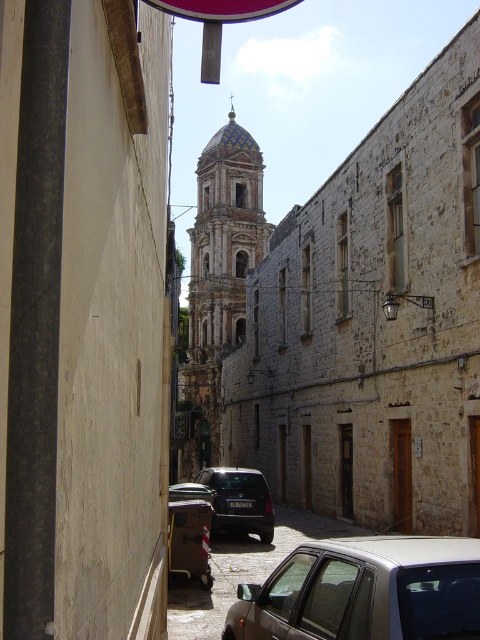
Who is lower down, stone tower at center or dark gray matte car at center?

Positioned lower is dark gray matte car at center.

Does stone tower at center come behind dark gray matte car at center?

No, it is not.

Does point (239, 364) come farther from viewer compared to point (239, 531)?

That is True.

Identify the location of stone tower at center. (374, 323).

Can you confirm if stone tower at center is bigger than golden mosaic dome at center?

No.

Can you confirm if stone tower at center is positioned to the right of golden mosaic dome at center?

Correct, you'll find stone tower at center to the right of golden mosaic dome at center.

Which is behind, point (333, 483) or point (180, 371)?

The point (180, 371) is behind.

Image resolution: width=480 pixels, height=640 pixels. In order to click on stone tower at center in this screenshot , I will do (x=374, y=323).

Does stone tower at center lie behind silver metallic car at lower center?

That is True.

Does stone tower at center appear on the left side of silver metallic car at lower center?

Indeed, stone tower at center is positioned on the left side of silver metallic car at lower center.

Between point (316, 417) and point (327, 550), which one is positioned in front?

Positioned in front is point (327, 550).

You are a GUI agent. You are given a task and a screenshot of the screen. Output one action in this format:
    pyautogui.click(x=<x>, y=<y>)
    Task: Click on the stone tower at center
    
    Given the screenshot: What is the action you would take?
    pyautogui.click(x=374, y=323)